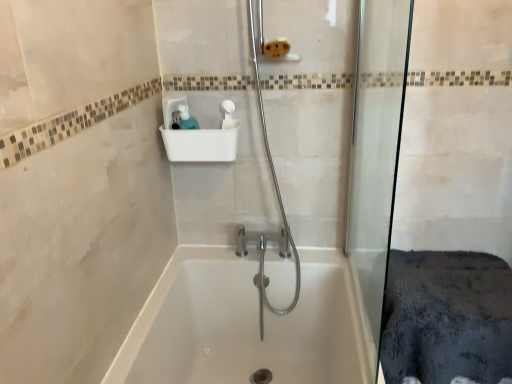
Image resolution: width=512 pixels, height=384 pixels. What are the coordinates of `white plastic sink at upper center` in the screenshot? It's located at (199, 135).

Locate an element on the screen. Image resolution: width=512 pixels, height=384 pixels. transparent glass shower door at right is located at coordinates [x=376, y=154].

Is white glossy bathtub at center turned away from transparent glass shower door at right?

No.

Visually, is white glossy bathtub at center positioned to the left or to the right of transparent glass shower door at right?

white glossy bathtub at center is positioned on transparent glass shower door at right's left side.

How different are the orientations of white glossy bathtub at center and transparent glass shower door at right in degrees?

white glossy bathtub at center and transparent glass shower door at right are facing 0.813 degrees away from each other.

From a real-world perspective, is white glossy bathtub at center physically above transparent glass shower door at right?

No, from a real-world perspective, white glossy bathtub at center is not above transparent glass shower door at right.

Can you tell me how much white plastic sink at upper center and transparent glass shower door at right differ in facing direction?

The angular difference between white plastic sink at upper center and transparent glass shower door at right is 89.1 degrees.

The height and width of the screenshot is (384, 512). What are the coordinates of `sink on the left side of transparent glass shower door at right` in the screenshot? It's located at (199, 135).

Which of these two, white plastic sink at upper center or transparent glass shower door at right, is wider?

white plastic sink at upper center is wider.

Which is in front, point (395, 163) or point (283, 286)?

The point (395, 163) is more forward.

Is transparent glass shower door at right thinner than white glossy bathtub at center?

Indeed, transparent glass shower door at right has a lesser width compared to white glossy bathtub at center.

This screenshot has width=512, height=384. I want to click on shower door lying in front of the white glossy bathtub at center, so click(376, 154).

Can you tell me how much transparent glass shower door at right and white glossy bathtub at center differ in facing direction?

transparent glass shower door at right and white glossy bathtub at center are facing 0.813 degrees away from each other.

From a real-world perspective, is white plastic sink at upper center physically below white glossy bathtub at center?

Incorrect, from a real-world perspective, white plastic sink at upper center is higher than white glossy bathtub at center.

Consider the image. Considering the sizes of objects white plastic sink at upper center and white glossy bathtub at center in the image provided, who is thinner, white plastic sink at upper center or white glossy bathtub at center?

white plastic sink at upper center is thinner.

Who is shorter, white plastic sink at upper center or white glossy bathtub at center?

white plastic sink at upper center is shorter.

From a real-world perspective, relative to white plastic sink at upper center, is transparent glass shower door at right vertically above or below?

transparent glass shower door at right is situated lower than white plastic sink at upper center in the real world.

Considering their positions, is transparent glass shower door at right located in front of or behind white plastic sink at upper center?

In the image, transparent glass shower door at right appears in front of white plastic sink at upper center.

Is white plastic sink at upper center located within transparent glass shower door at right?

No, white plastic sink at upper center is not inside transparent glass shower door at right.

From the picture: Considering the relative sizes of white glossy bathtub at center and white plastic sink at upper center in the image provided, is white glossy bathtub at center shorter than white plastic sink at upper center?

In fact, white glossy bathtub at center may be taller than white plastic sink at upper center.

In terms of width, does white glossy bathtub at center look wider or thinner when compared to white plastic sink at upper center?

Clearly, white glossy bathtub at center has more width compared to white plastic sink at upper center.

Would you say white glossy bathtub at center is inside or outside white plastic sink at upper center?

white glossy bathtub at center is outside white plastic sink at upper center.

Based on their positions, is white glossy bathtub at center located to the left or right of white plastic sink at upper center?

white glossy bathtub at center is positioned on white plastic sink at upper center's right side.

At what (x,y) coordinates should I click in order to perform the action: click on bathtub below the transparent glass shower door at right (from the image's perspective). Please return your answer as a coordinate pair (x, y). The width and height of the screenshot is (512, 384). Looking at the image, I should click on (244, 324).

Where is `sink on the left of transparent glass shower door at right`? This screenshot has width=512, height=384. sink on the left of transparent glass shower door at right is located at coordinates (199, 135).

When comparing their distances from white glossy bathtub at center, does white plastic sink at upper center or transparent glass shower door at right seem further?

The object further to white glossy bathtub at center is white plastic sink at upper center.

Estimate the real-world distances between objects in this image. Which object is closer to white plastic sink at upper center, transparent glass shower door at right or white glossy bathtub at center?

Based on the image, transparent glass shower door at right appears to be nearer to white plastic sink at upper center.

Considering their positions, is white glossy bathtub at center positioned closer to white plastic sink at upper center than transparent glass shower door at right?

The object closer to white plastic sink at upper center is transparent glass shower door at right.

Which object lies further to the anchor point transparent glass shower door at right, white glossy bathtub at center or white plastic sink at upper center?

white plastic sink at upper center lies further to transparent glass shower door at right than the other object.

Which object lies further to the anchor point white glossy bathtub at center, transparent glass shower door at right or white plastic sink at upper center?

white plastic sink at upper center.

From the image, which object appears to be farther from transparent glass shower door at right, white plastic sink at upper center or white glossy bathtub at center?

white plastic sink at upper center lies further to transparent glass shower door at right than the other object.

Identify the location of shower door between white plastic sink at upper center and white glossy bathtub at center in the vertical direction. (376, 154).